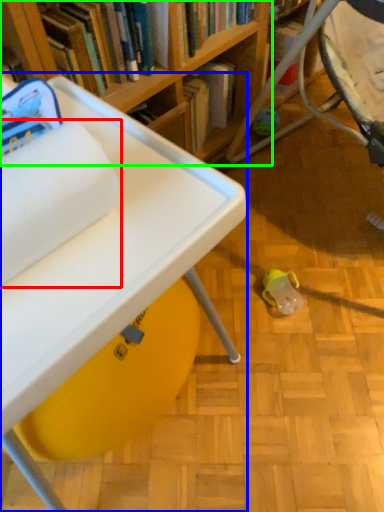
Question: Which object is positioned closest to toilet paper (highlighted by a red box)? Select from table (highlighted by a blue box) and bookcase (highlighted by a green box).

Choices:
 (A) table
 (B) bookcase

Answer: (A)